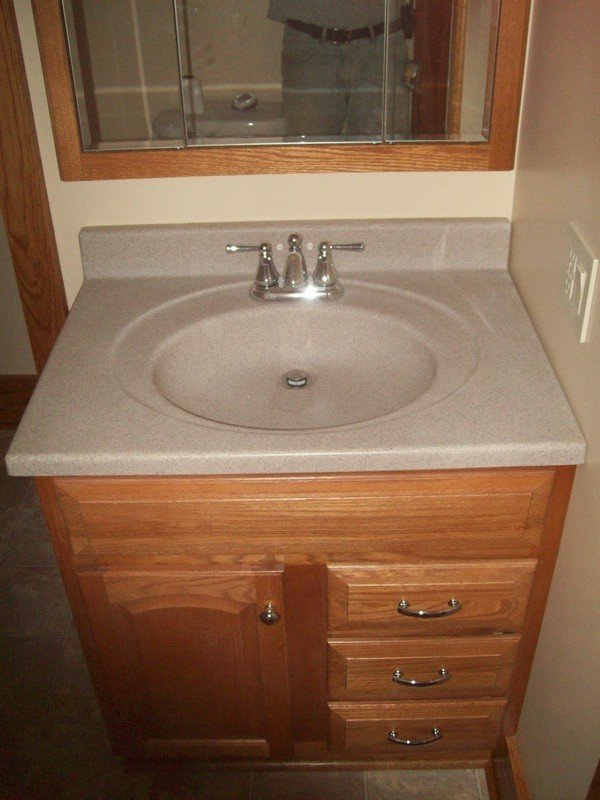
At what (x,y) coordinates should I click in order to perform the action: click on sink. Please return your answer as a coordinate pair (x, y). This screenshot has height=800, width=600. Looking at the image, I should click on (348, 414).